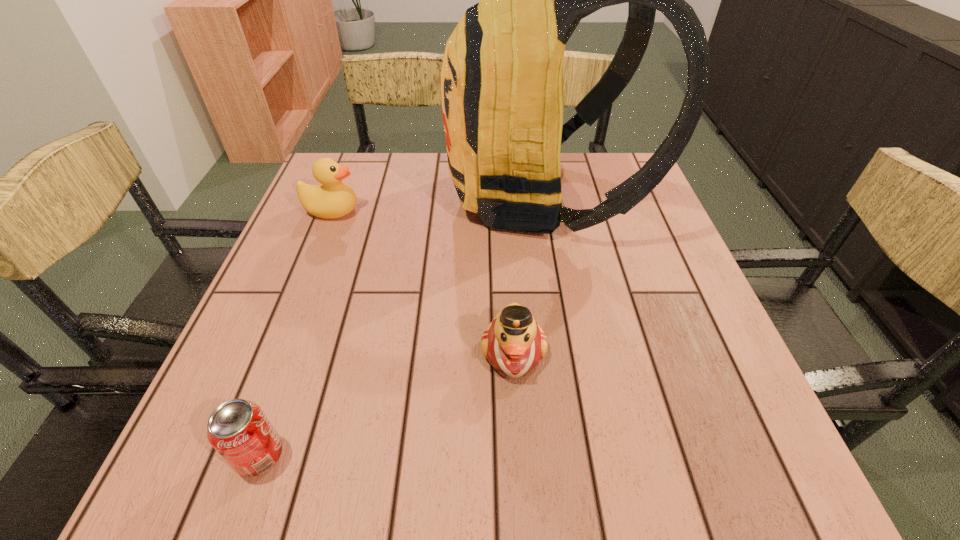
Find the location of a particular element. backpack is located at coordinates (502, 74).

Find the location of a particular element. the left duck is located at coordinates (334, 199).

The height and width of the screenshot is (540, 960). I want to click on the third farthest object, so click(x=513, y=343).

Locate an element on the screen. The image size is (960, 540). the right duck is located at coordinates (513, 343).

The height and width of the screenshot is (540, 960). Find the location of `soda can`. soda can is located at coordinates (238, 429).

You are a GUI agent. You are given a task and a screenshot of the screen. Output one action in this format:
    pyautogui.click(x=<x>, y=<y>)
    Task: Click on the blank space located on the front-facing side of the tallest object
    This screenshot has width=960, height=540.
    Given the screenshot: What is the action you would take?
    pyautogui.click(x=369, y=198)

The width and height of the screenshot is (960, 540). Identify the location of vacant space situated on the front-facing side of the tallest object. (318, 198).

What are the coordinates of `free region located 0.190m on the front-facing side of the tallest object` in the screenshot? It's located at (373, 198).

I want to click on vacant area located at the beak of the farther duck, so click(x=448, y=211).

What are the coordinates of `vacant region located on the face of the nearer duck` in the screenshot? It's located at (521, 469).